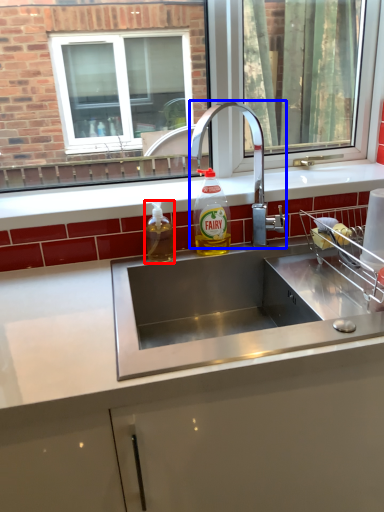
Question: Which of the following is the closest to the observer, bottle (highlighted by a red box) or tap (highlighted by a blue box)?

Choices:
 (A) bottle
 (B) tap

Answer: (B)